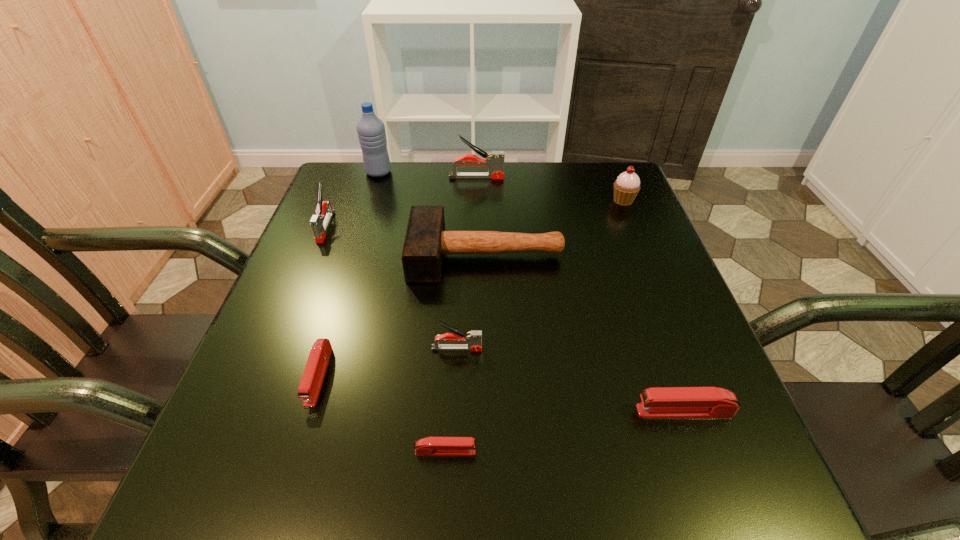
Find the location of `the rightmost red stapler`. the rightmost red stapler is located at coordinates (665, 402).

You are a GUI agent. You are given a task and a screenshot of the screen. Output one action in this format:
    pyautogui.click(x=<x>, y=<y>)
    Task: Click on the biggest red stapler
    Image resolution: width=960 pixels, height=540 pixels.
    Given the screenshot: What is the action you would take?
    pyautogui.click(x=665, y=402)

Identify the location of the second smallest red stapler. (314, 372).

In order to click on the fifth tallest stapler in this screenshot , I will do `click(314, 372)`.

The image size is (960, 540). Identify the location of the nearest stapler. (431, 446).

Where is `the shortest stapler`? Image resolution: width=960 pixels, height=540 pixels. the shortest stapler is located at coordinates [431, 446].

The width and height of the screenshot is (960, 540). I want to click on free space located 0.370m on the front of the blue water bottle, so click(348, 272).

Identify the location of vacant space located on the handle side of the biggest gray stapler. (537, 177).

I want to click on vacant space located 0.320m on the handle side of the leftmost gray stapler, so click(x=272, y=359).

Image resolution: width=960 pixels, height=540 pixels. In order to click on vacant space located on the handle side of the smallest gray stapler in this screenshot , I will do `click(660, 348)`.